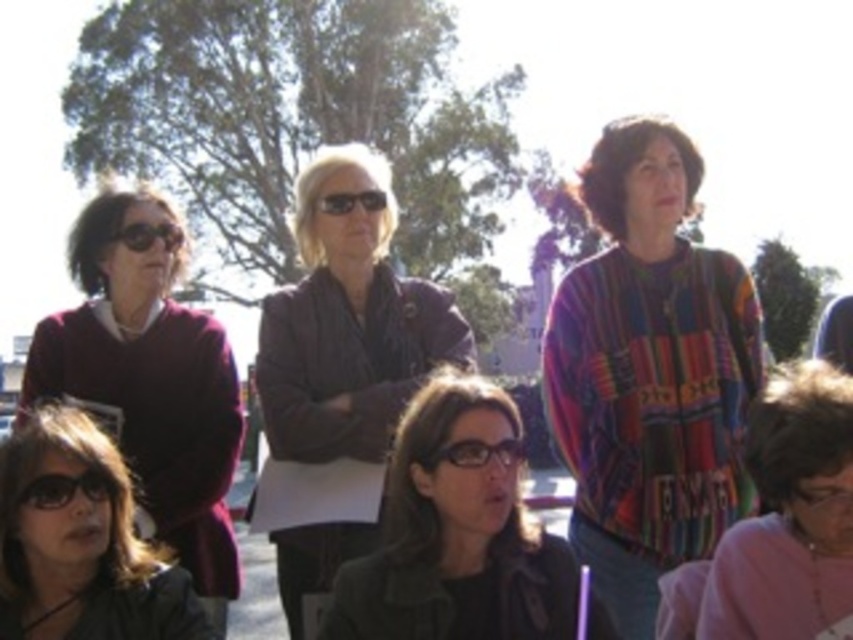
Question: Which object appears farthest from the camera in this image?

Choices:
 (A) pink fabric at lower right
 (B) multicolored woven sweater at center
 (C) matte black jacket at center

Answer: (B)

Question: Is multicolored woven sweater at center below dark brown leather jacket at center?

Choices:
 (A) no
 (B) yes

Answer: (B)

Question: Can you confirm if dark brown leather jacket at center is thinner than clear plastic glasses at center?

Choices:
 (A) no
 (B) yes

Answer: (A)

Question: Considering the relative positions of matte maroon sweater at left and black plastic glasses at lower left in the image provided, where is matte maroon sweater at left located with respect to black plastic glasses at lower left?

Choices:
 (A) right
 (B) left

Answer: (A)

Question: Which is nearer to the black plastic goggles at upper left?

Choices:
 (A) dark brown leather jacket at center
 (B) clear plastic glasses at center
 (C) matte black jacket at lower left

Answer: (A)

Question: Which of the following is the farthest from the observer?

Choices:
 (A) clear plastic glasses at center
 (B) matte black jacket at center
 (C) matte black jacket at lower left

Answer: (A)